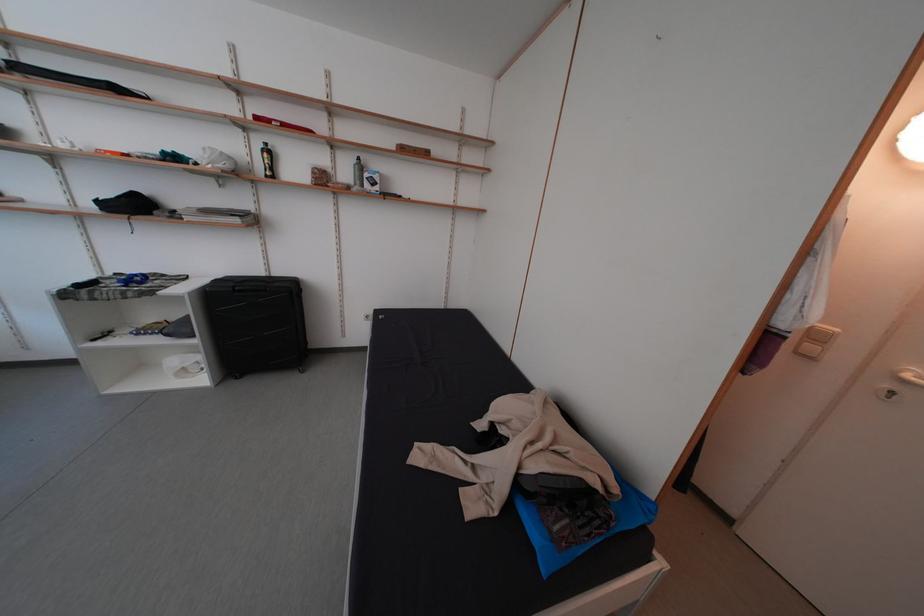
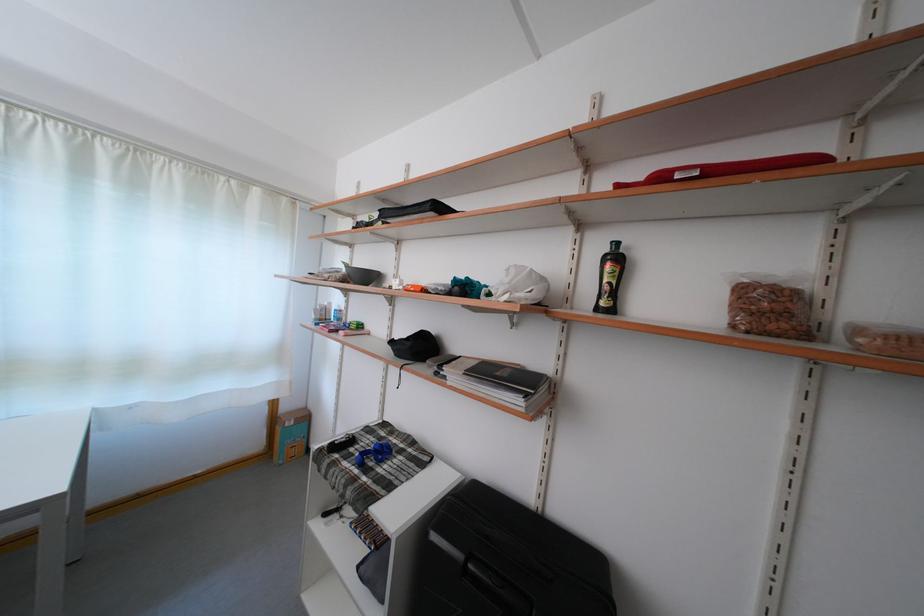
The point at (275, 180) is marked in the first image. Where is the corresponding point in the second image?

(606, 314)